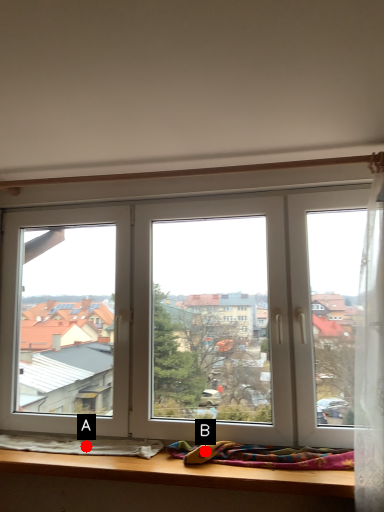
Question: Two points are circled on the image, labeled by A and B beside each circle. Which point appears closest to the camera in this image?

Choices:
 (A) A is closer
 (B) B is closer

Answer: (B)